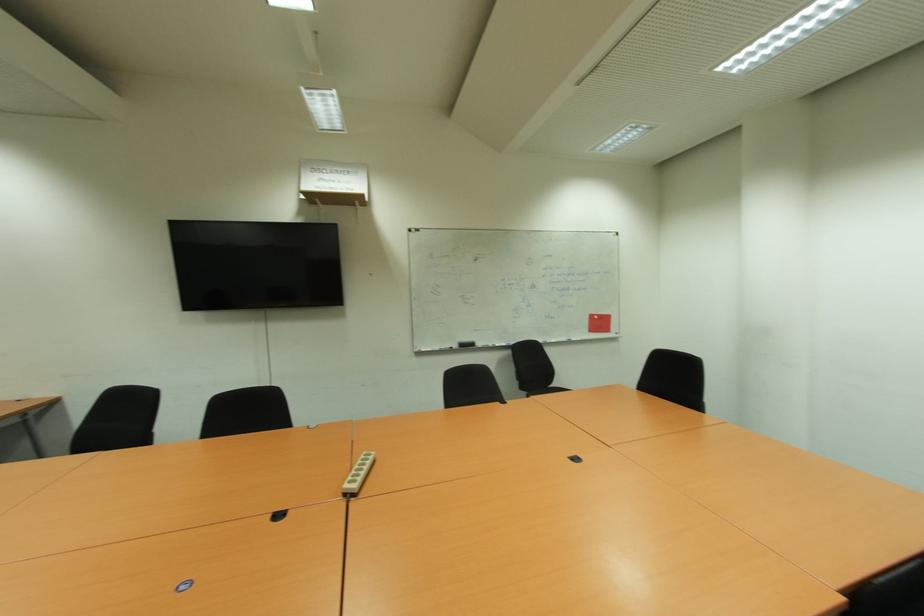
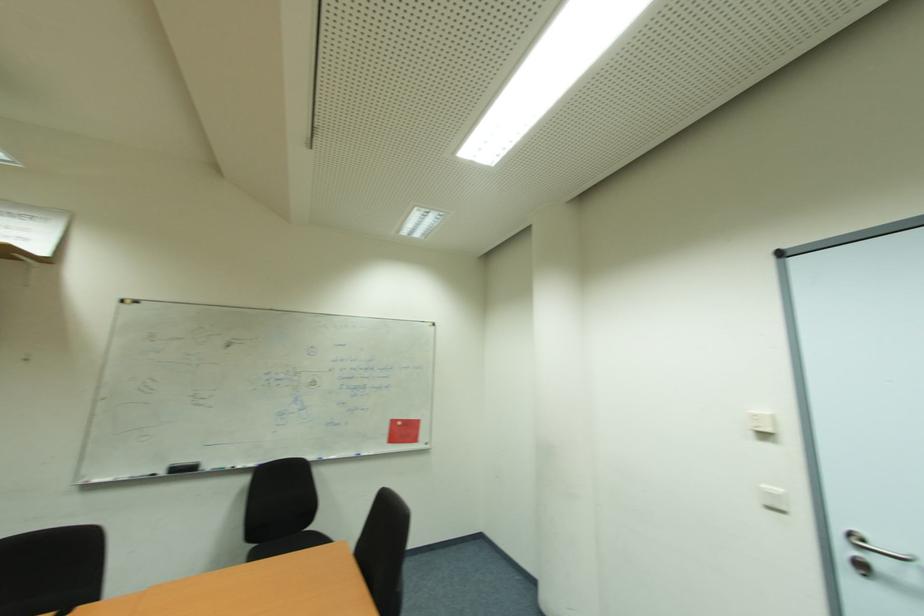
In the second image, find the point that corresponds to point 594,315 in the first image.

(397, 423)